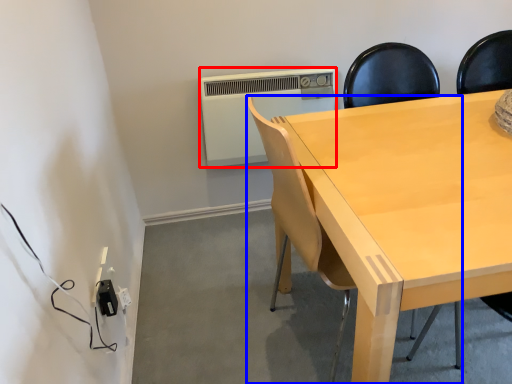
Question: Which object appears closest to the camera in this image, air conditioning (highlighted by a red box) or chair (highlighted by a blue box)?

Choices:
 (A) air conditioning
 (B) chair

Answer: (B)